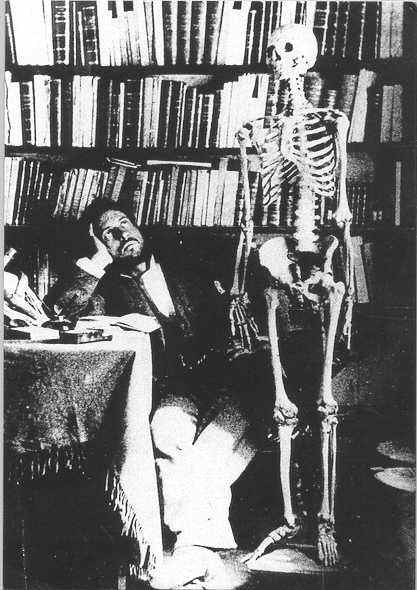
I want to click on table, so click(x=97, y=345).